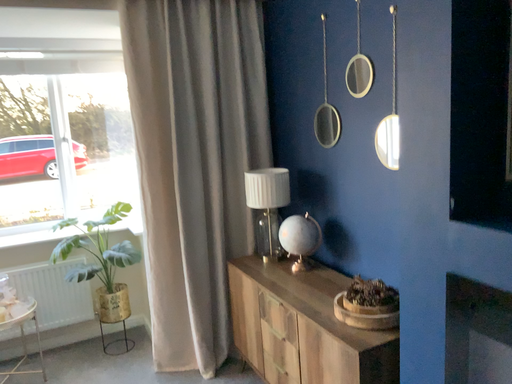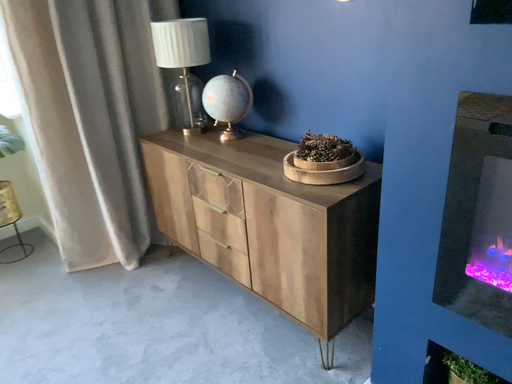
Question: How did the camera likely rotate when shooting the video?

Choices:
 (A) rotated left
 (B) rotated right

Answer: (B)